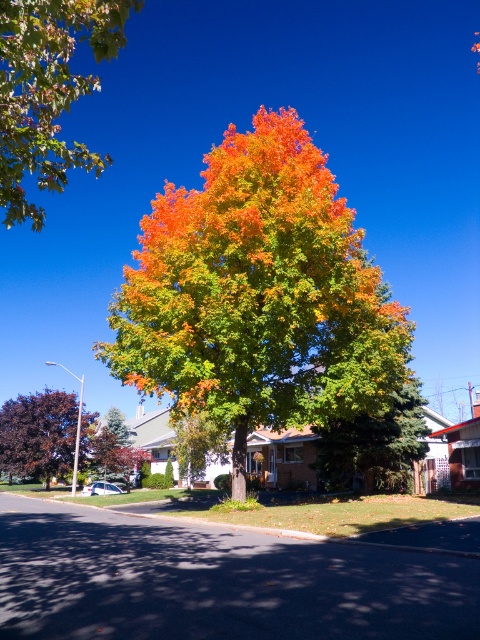
Question: Can you confirm if vivid orange leaves at center is smaller than purple glossy tree at left?

Choices:
 (A) no
 (B) yes

Answer: (A)

Question: Does vivid orange leaves at center have a lesser width compared to green matte tree at center?

Choices:
 (A) no
 (B) yes

Answer: (A)

Question: Which object appears closest to the camera in this image?

Choices:
 (A) green matte leaves at upper left
 (B) green matte tree at center
 (C) vivid orange leaves at center
 (D) purple glossy tree at left

Answer: (A)

Question: Which point is closer to the camera?

Choices:
 (A) [x=55, y=147]
 (B) [x=19, y=426]
 (C) [x=386, y=452]
 (D) [x=187, y=332]

Answer: (A)

Question: Which point is closer to the camera?

Choices:
 (A) purple glossy tree at left
 (B) green matte tree at center
 (C) vivid orange leaves at center

Answer: (C)

Question: From the image, what is the correct spatial relationship of green matte tree at center in relation to purple glossy tree at left?

Choices:
 (A) above
 (B) below

Answer: (A)